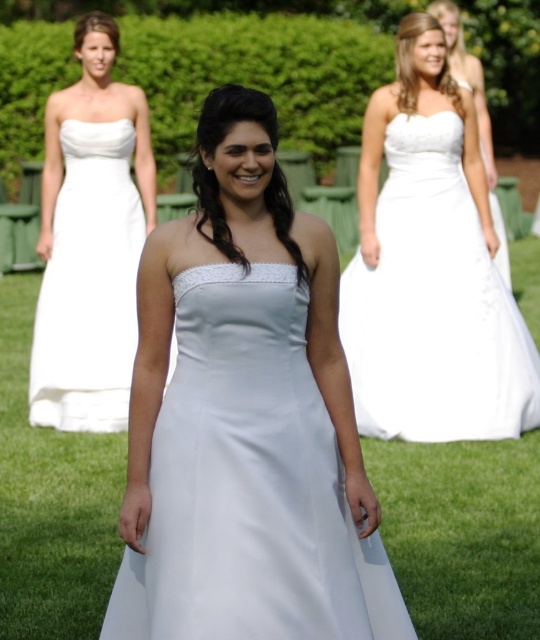
Question: Which is nearer to the white satin dress at upper center?

Choices:
 (A) white satin dress at upper left
 (B) satin white dress at center

Answer: (A)

Question: Can you confirm if white satin dress at upper center is positioned to the right of white satin dress at upper left?

Choices:
 (A) yes
 (B) no

Answer: (A)

Question: Which object appears farthest from the camera in this image?

Choices:
 (A) white satin dress at center
 (B) satin white dress at center
 (C) white satin dress at upper left

Answer: (A)

Question: Considering the real-world distances, which object is closest to the white satin dress at center?

Choices:
 (A) white satin dress at upper left
 (B) satin white dress at center

Answer: (A)

Question: Can you confirm if white satin dress at upper center is positioned to the left of white satin dress at center?

Choices:
 (A) yes
 (B) no

Answer: (A)

Question: Is white satin dress at upper center bigger than white satin dress at upper left?

Choices:
 (A) no
 (B) yes

Answer: (B)